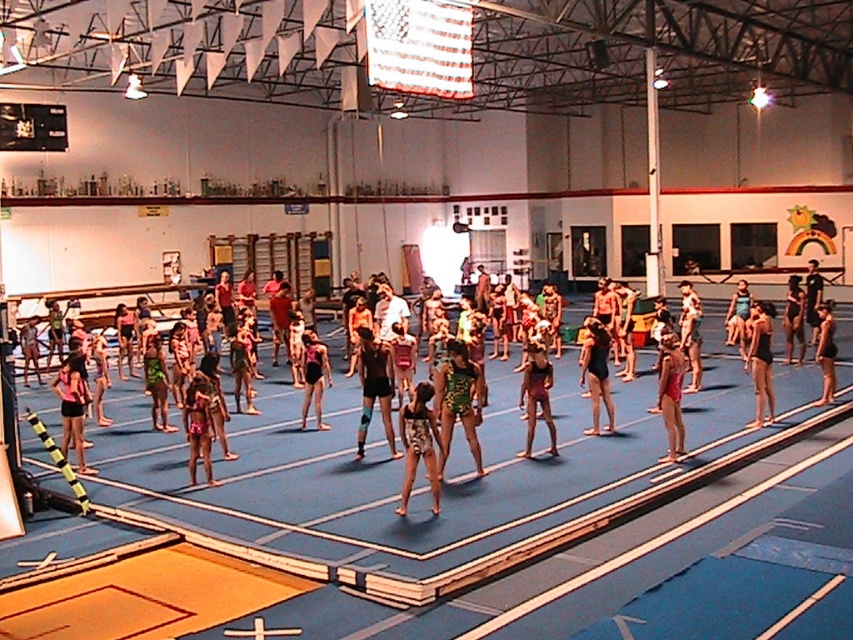
This screenshot has height=640, width=853. What do you see at coordinates (447, 460) in the screenshot? I see `multicolored swimsuit at center` at bounding box center [447, 460].

Which is behind, point (260, 467) or point (416, 396)?

The point (260, 467) is more distant.

In order to click on multicolored swimsuit at center in this screenshot , I will do coord(447,460).

Locate an element on the screen. The height and width of the screenshot is (640, 853). multicolored swimsuit at center is located at coordinates (447, 460).

Which is below, black matte swimsuit at center or matte black leotard at center?

matte black leotard at center is lower down.

Image resolution: width=853 pixels, height=640 pixels. What do you see at coordinates (761, 364) in the screenshot? I see `black matte swimsuit at center` at bounding box center [761, 364].

Is point (752, 362) positioned after point (525, 374)?

Yes, point (752, 362) is behind point (525, 374).

This screenshot has width=853, height=640. I want to click on black matte swimsuit at center, so click(x=761, y=364).

In the scene shown: Who is positioned more to the right, multicolored swimsuit at center or black matte swimsuit at center?

From the viewer's perspective, black matte swimsuit at center appears more on the right side.

Who is more forward, [701,435] or [759,349]?

Point [701,435] is in front.

Locate an element on the screen. This screenshot has width=853, height=640. multicolored swimsuit at center is located at coordinates (447, 460).